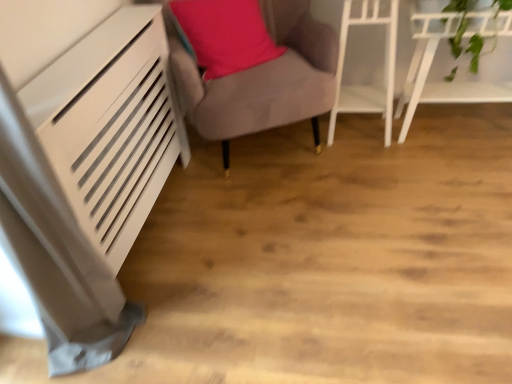
Identify the location of free space in front of white glossy shelf at upper right, placed as the third furniture when sorted from left to right. (462, 177).